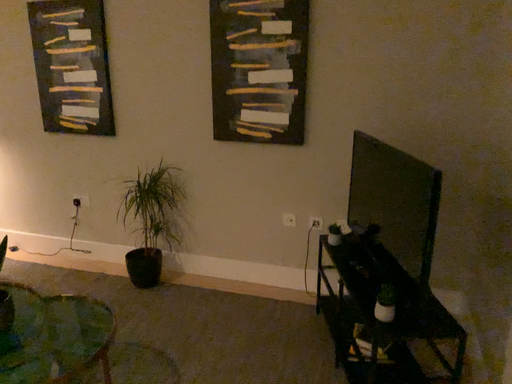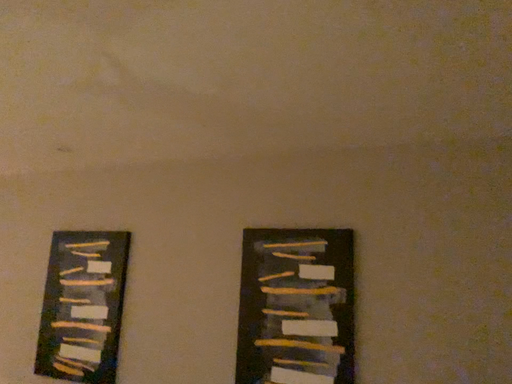
Question: Which way did the camera rotate in the video?

Choices:
 (A) rotated upward
 (B) rotated downward

Answer: (A)